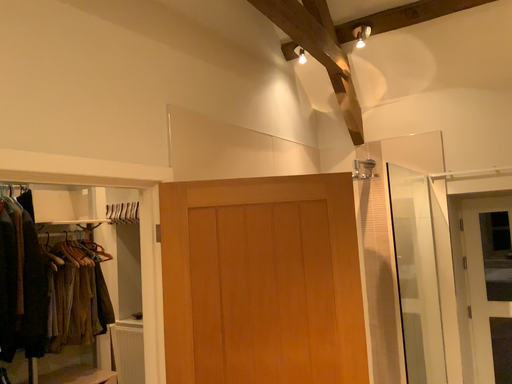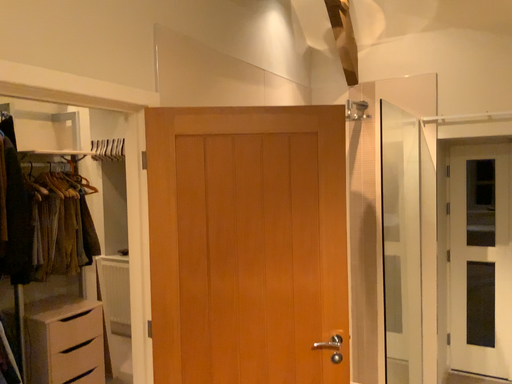
Question: Which way did the camera rotate in the video?

Choices:
 (A) rotated downward
 (B) rotated upward

Answer: (A)